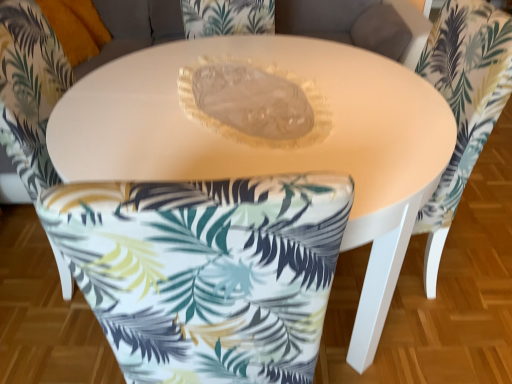
Question: Is white fabric chair at lower center, which appears as the first chair when viewed from the left, positioned behind white fabric chair at center, which is the second chair from left to right?

Choices:
 (A) yes
 (B) no

Answer: (B)

Question: Is white fabric chair at lower center, which is counted as the 2th chair, starting from the right, at the left side of white fabric chair at center, which is the second chair from left to right?

Choices:
 (A) yes
 (B) no

Answer: (A)

Question: From a real-world perspective, is white fabric chair at lower center, which is counted as the 2th chair, starting from the right, below white fabric chair at center, which is the first chair in right-to-left order?

Choices:
 (A) yes
 (B) no

Answer: (B)

Question: Is white fabric chair at lower center, which is counted as the 2th chair, starting from the right, with white fabric chair at center, which is the second chair from left to right?

Choices:
 (A) yes
 (B) no

Answer: (B)

Question: Is white fabric chair at lower center, which appears as the first chair when viewed from the left, completely or partially outside of white fabric chair at center, which is the first chair in right-to-left order?

Choices:
 (A) no
 (B) yes

Answer: (B)

Question: Is white fabric chair at center, which is the second chair from left to right, located within white fabric chair at lower center, which is counted as the 2th chair, starting from the right?

Choices:
 (A) yes
 (B) no

Answer: (B)

Question: From a real-world perspective, is matte white table at center physically above white fabric chair at lower center, which appears as the first chair when viewed from the left?

Choices:
 (A) yes
 (B) no

Answer: (B)

Question: From the image's perspective, is matte white table at center below white fabric chair at lower center, which appears as the first chair when viewed from the left?

Choices:
 (A) yes
 (B) no

Answer: (A)

Question: Can you see matte white table at center touching white fabric chair at lower center, which is counted as the 2th chair, starting from the right?

Choices:
 (A) no
 (B) yes

Answer: (A)

Question: Is matte white table at center not inside white fabric chair at lower center, which is counted as the 2th chair, starting from the right?

Choices:
 (A) no
 (B) yes

Answer: (B)

Question: Does matte white table at center lie in front of white fabric chair at lower center, which appears as the first chair when viewed from the left?

Choices:
 (A) yes
 (B) no

Answer: (A)

Question: Is white fabric chair at lower center, which is counted as the 2th chair, starting from the right, inside matte white table at center?

Choices:
 (A) yes
 (B) no

Answer: (A)

Question: From the image's perspective, is white fabric chair at lower center, which is counted as the 2th chair, starting from the right, over matte white table at center?

Choices:
 (A) no
 (B) yes

Answer: (B)